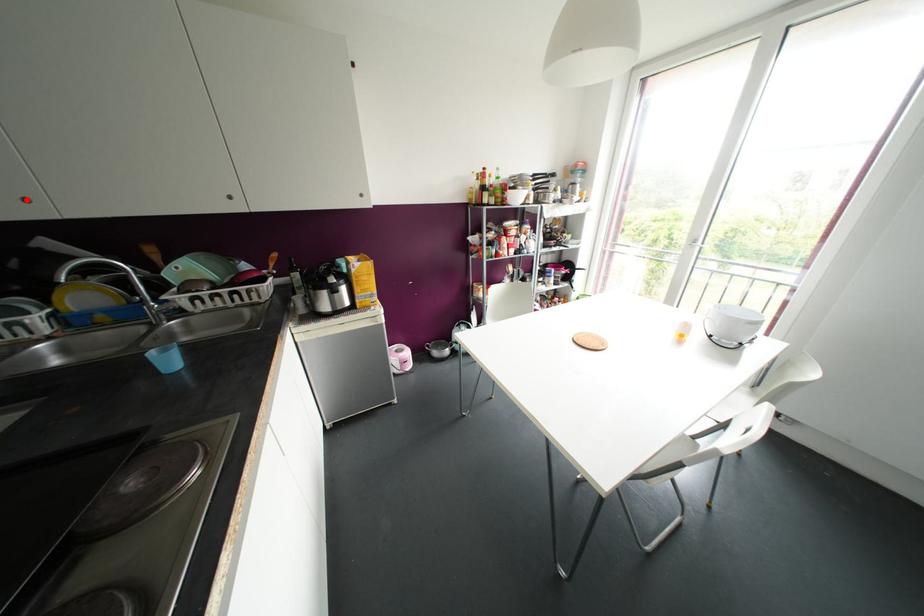
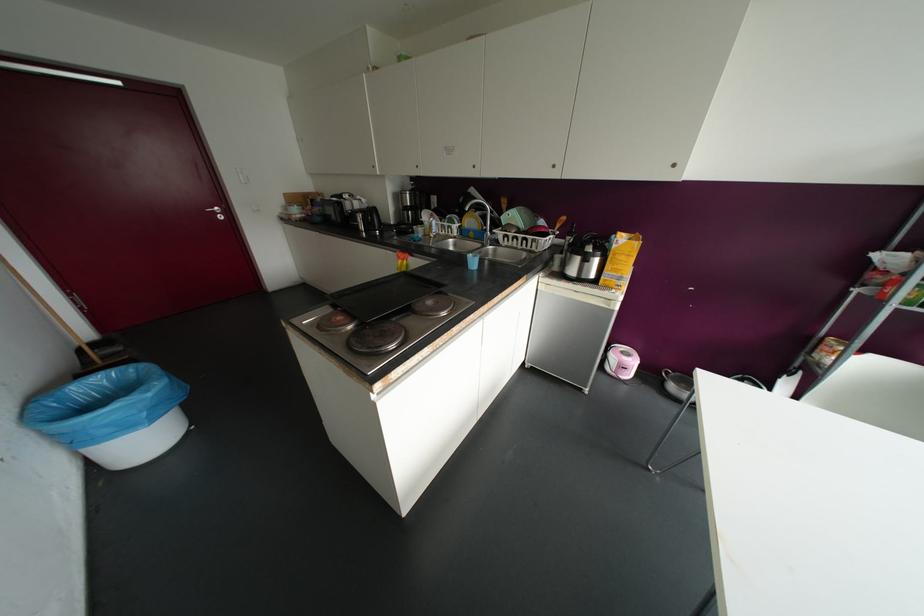
In the second image, find the point that corresponds to the highlighted location in the first image.

(473, 166)